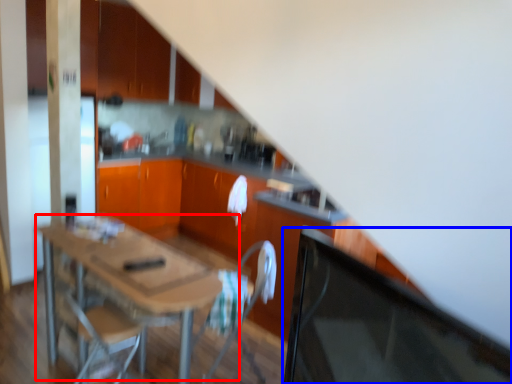
Question: Which object appears farthest to the camera in this image, table (highlighted by a red box) or computer monitor (highlighted by a blue box)?

Choices:
 (A) table
 (B) computer monitor

Answer: (A)